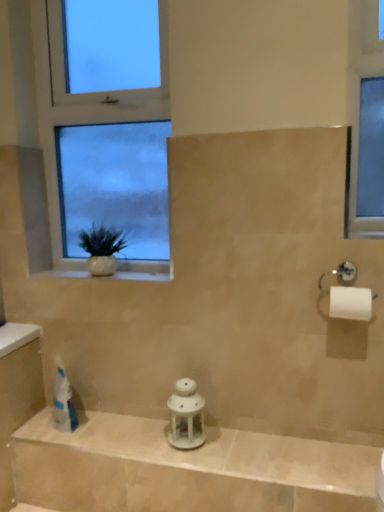
Find the location of a particular element. free point above white glossy lantern at center (from a real-world perspective) is located at coordinates (193, 440).